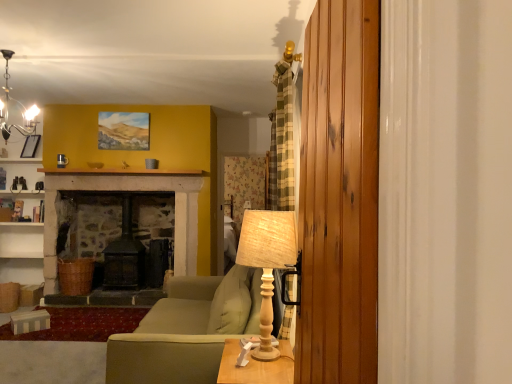
Question: In terms of width, does green fabric couch at center look wider or thinner when compared to wooden barn door at right?

Choices:
 (A) thin
 (B) wide

Answer: (B)

Question: Is green fabric couch at center taller or shorter than wooden barn door at right?

Choices:
 (A) short
 (B) tall

Answer: (A)

Question: Which object is positioned farthest from the matte black chandelier at upper left?

Choices:
 (A) wooden barn door at right
 (B) green fabric couch at center
 (C) matte black picture frame at upper left
 (D) wooden table at lower center
 (E) wooden table lamp at center

Answer: (A)

Question: Which object is the closest to the matte black chandelier at upper left?

Choices:
 (A) green fabric couch at center
 (B) wooden table at lower center
 (C) wooden barn door at right
 (D) wooden table lamp at center
 (E) matte black picture frame at upper left

Answer: (E)